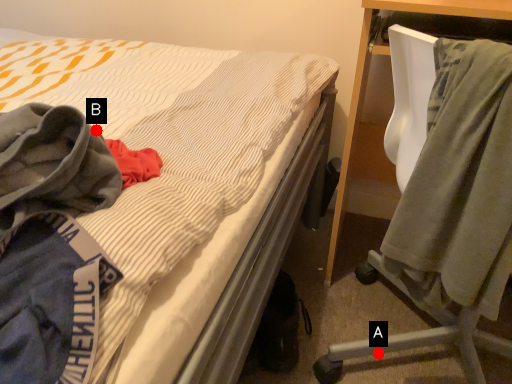
Question: Two points are circled on the image, labeled by A and B beside each circle. Among these points, which one is nearest to the camera?

Choices:
 (A) A is closer
 (B) B is closer

Answer: (B)